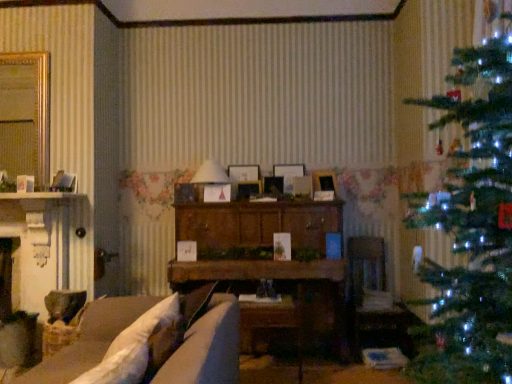
How much space does wooden picture frame at center, positioned as the 3th picture frame in left-to-right order, occupy horizontally?

wooden picture frame at center, positioned as the 3th picture frame in left-to-right order, is 10.27 centimeters in width.

The height and width of the screenshot is (384, 512). I want to click on green matte christmas tree at right, so click(472, 224).

Describe the element at coordinates (324, 184) in the screenshot. I see `matte white picture frame at center, which is the 5th picture frame from left to right` at that location.

Find the location of a particular element. This screenshot has width=512, height=384. white paper lampshade at center is located at coordinates (210, 173).

Looking at this image, from a real-world perspective, between wooden cabinet at center and wooden picture frame at center, which ranks as the fifth picture frame in right-to-left order, who is vertically lower?

In real-world perspective, wooden cabinet at center is lower.

Considering the sizes of wooden cabinet at center and wooden picture frame at center, which ranks as the fifth picture frame in right-to-left order, in the image, is wooden cabinet at center taller or shorter than wooden picture frame at center, which ranks as the fifth picture frame in right-to-left order,?

Considering their sizes, wooden cabinet at center has more height than wooden picture frame at center, which ranks as the fifth picture frame in right-to-left order.

Considering the sizes of wooden cabinet at center and wooden picture frame at center, which ranks as the fifth picture frame in right-to-left order, in the image, is wooden cabinet at center bigger or smaller than wooden picture frame at center, which ranks as the fifth picture frame in right-to-left order,?

wooden cabinet at center is bigger than wooden picture frame at center, which ranks as the fifth picture frame in right-to-left order.

What's the angular difference between wooden cabinet at center and wooden picture frame at center, which ranks as the fifth picture frame in right-to-left order,'s facing directions?

0.18 degrees.

Looking at the image, does velvet beige couch at lower left seem bigger or smaller compared to green matte christmas tree at right?

Considering their sizes, velvet beige couch at lower left takes up more space than green matte christmas tree at right.

Is point (191, 342) positioned behind point (504, 203)?

That is True.

Does velvet beige couch at lower left turn towards green matte christmas tree at right?

No, velvet beige couch at lower left is not oriented towards green matte christmas tree at right.

From the image's perspective, is velvet beige couch at lower left below green matte christmas tree at right?

Yes, from the image's perspective, velvet beige couch at lower left is below green matte christmas tree at right.

Considering the points (239, 197) and (350, 305), which point is behind, point (239, 197) or point (350, 305)?

The point (350, 305) is more distant.

Who is smaller, wooden picture frame at center, which appears as the second picture frame when viewed from the left, or velvet brown armchair at center?

wooden picture frame at center, which appears as the second picture frame when viewed from the left, is smaller.

From the picture: Is wooden picture frame at center, the 4th picture frame when ordered from right to left, facing towards velvet brown armchair at center?

No, wooden picture frame at center, the 4th picture frame when ordered from right to left, is not turned towards velvet brown armchair at center.

Looking at this image, between wooden picture frame at center, which appears as the second picture frame when viewed from the left, and velvet brown armchair at center, which one appears on the left side from the viewer's perspective?

From the viewer's perspective, wooden picture frame at center, which appears as the second picture frame when viewed from the left, appears more on the left side.

Which of these two, velvet beige couch at lower left or white soft pillow at lower left, is wider?

velvet beige couch at lower left is wider.

Are velvet beige couch at lower left and white soft pillow at lower left far apart?

No, velvet beige couch at lower left is not far away from white soft pillow at lower left.

I want to click on studio couch that appears in front of the white soft pillow at lower left, so click(207, 348).

Is velvet beige couch at lower left looking in the opposite direction of white soft pillow at lower left?

Correct, velvet beige couch at lower left is looking away from white soft pillow at lower left.

Between point (365, 259) and point (213, 164), which one is positioned behind?

The point (365, 259) is farther from the camera.

Is velvet brown armchair at center positioned behind white paper lampshade at center?

No, velvet brown armchair at center is closer to the viewer.

Would you say velvet brown armchair at center is outside white paper lampshade at center?

velvet brown armchair at center lies outside white paper lampshade at center's area.

Based on the photo, looking at their sizes, would you say wooden picture frame at center, the 4th picture frame when ordered from right to left, is wider or thinner than green matte christmas tree at right?

Clearly, wooden picture frame at center, the 4th picture frame when ordered from right to left, has less width compared to green matte christmas tree at right.

Could you tell me if wooden picture frame at center, which appears as the second picture frame when viewed from the left, is turned towards green matte christmas tree at right?

No, wooden picture frame at center, which appears as the second picture frame when viewed from the left, is not oriented towards green matte christmas tree at right.

Is wooden picture frame at center, which appears as the second picture frame when viewed from the left, not inside green matte christmas tree at right?

Yes, wooden picture frame at center, which appears as the second picture frame when viewed from the left, is outside of green matte christmas tree at right.

Is point (244, 197) behind point (485, 115)?

Yes, it is.

Is wooden picture frame at center, which appears as the second picture frame when viewed from the left, facing away from gold metallic mirror at upper left?

No, gold metallic mirror at upper left is not at the back of wooden picture frame at center, which appears as the second picture frame when viewed from the left.

Does wooden picture frame at center, which appears as the second picture frame when viewed from the left, have a smaller size compared to gold metallic mirror at upper left?

Indeed, wooden picture frame at center, which appears as the second picture frame when viewed from the left, has a smaller size compared to gold metallic mirror at upper left.

Where is `window in front of the wooden picture frame at center, the 4th picture frame when ordered from right to left`? window in front of the wooden picture frame at center, the 4th picture frame when ordered from right to left is located at coordinates (25, 115).

From the wooden cabinet at center, count the 2nd picture frame to the left and point to it. Please provide its 2D coordinates.

[(243, 173)]

Where is `studio couch in front of the green matte christmas tree at right`? The image size is (512, 384). studio couch in front of the green matte christmas tree at right is located at coordinates (207, 348).

Which object lies nearer to the anchor point gold metallic mirror at upper left, wooden picture frame at center, marked as the 2th picture frame in a right-to-left arrangement, or velvet beige couch at lower left?

velvet beige couch at lower left lies closer to gold metallic mirror at upper left than the other object.

Based on their spatial positions, is velvet beige couch at lower left or gold metallic mirror at upper left closer to wooden cabinet at center?

The object closer to wooden cabinet at center is velvet beige couch at lower left.

Which object lies further to the anchor point green matte christmas tree at right, wooden picture frame at center, marked as the 2th picture frame in a right-to-left arrangement, or wooden picture frame at center, which ranks as the fifth picture frame in right-to-left order?

wooden picture frame at center, which ranks as the fifth picture frame in right-to-left order.

Based on their spatial positions, is wooden cabinet at center or matte white picture frame at center, the first picture frame when ordered from right to left, further from wooden picture frame at center, placed as the fourth picture frame when sorted from left to right?

wooden cabinet at center is further to wooden picture frame at center, placed as the fourth picture frame when sorted from left to right.

Based on their spatial positions, is velvet beige couch at lower left or wooden picture frame at center, which appears as the second picture frame when viewed from the left, closer to wooden cabinet at center?

wooden picture frame at center, which appears as the second picture frame when viewed from the left, is closer to wooden cabinet at center.

From the image, which object appears to be farther from velvet beige couch at lower left, wooden picture frame at center, which appears as the second picture frame when viewed from the left, or wooden cabinet at center?

Among the two, wooden picture frame at center, which appears as the second picture frame when viewed from the left, is located further to velvet beige couch at lower left.

Which object lies further to the anchor point wooden picture frame at center, which ranks as the fifth picture frame in right-to-left order, wooden cabinet at center or green matte christmas tree at right?

Based on the image, green matte christmas tree at right appears to be further to wooden picture frame at center, which ranks as the fifth picture frame in right-to-left order.

Looking at the image, which one is located further to wooden picture frame at center, which appears as the second picture frame when viewed from the left, wooden cabinet at center or wooden picture frame at center, positioned as the 3th picture frame in left-to-right order?

wooden cabinet at center.

You are a GUI agent. You are given a task and a screenshot of the screen. Output one action in this format:
    pyautogui.click(x=<x>, y=<y>)
    Task: Click on the christmas tree located between white soft pillow at lower left and wooden picture frame at center, the first picture frame when ordered from left to right, in the depth direction
    
    Given the screenshot: What is the action you would take?
    472,224

Locate an element on the screen. This screenshot has width=512, height=384. christmas tree between velvet beige couch at lower left and matte white picture frame at center, which is the 5th picture frame from left to right, along the z-axis is located at coordinates (472, 224).

Where is `lamp located between white soft pillow at lower left and green matte christmas tree at right in the left-right direction`? The image size is (512, 384). lamp located between white soft pillow at lower left and green matte christmas tree at right in the left-right direction is located at coordinates (210, 173).

The width and height of the screenshot is (512, 384). I want to click on lamp between gold metallic mirror at upper left and wooden picture frame at center, which is the 3th picture frame from right to left, from left to right, so click(210, 173).